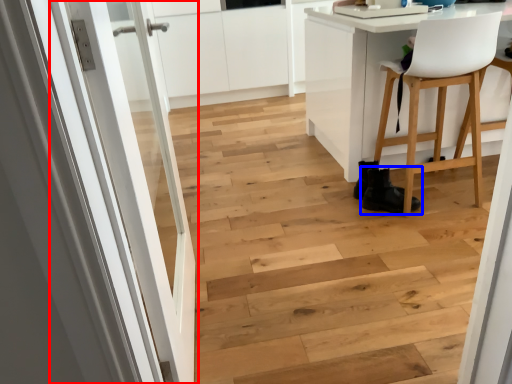
Question: Which of the following is the farthest to the observer, door (highlighted by a red box) or footwear (highlighted by a blue box)?

Choices:
 (A) door
 (B) footwear

Answer: (B)